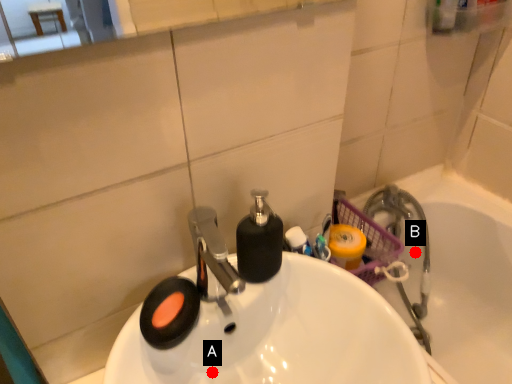
Question: Two points are circled on the image, labeled by A and B beside each circle. Which point is closer to the camera?

Choices:
 (A) A is closer
 (B) B is closer

Answer: (A)